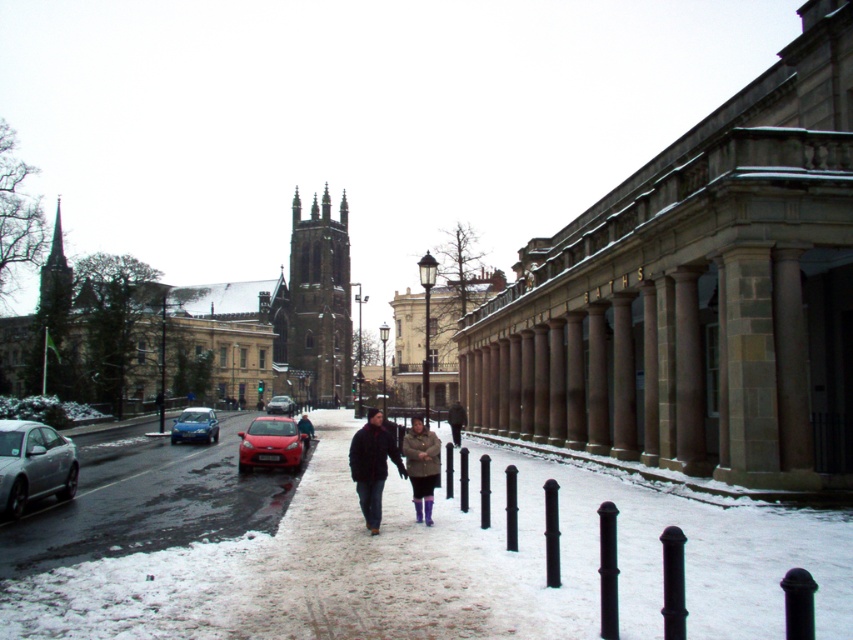
Which of these two, brown stone church at center or shiny red car at center, stands taller?

brown stone church at center is taller.

Which is in front, point (282, 275) or point (294, 460)?

Point (294, 460) is in front.

At what (x,y) coordinates should I click in order to perform the action: click on brown stone church at center. Please return your answer as a coordinate pair (x, y). The width and height of the screenshot is (853, 640). Looking at the image, I should click on (252, 326).

Does brown stone church at center appear under white stone church at center?

Actually, brown stone church at center is above white stone church at center.

Can you confirm if brown stone church at center is bigger than white stone church at center?

Yes.

Is point (346, 352) closer to viewer compared to point (505, 282)?

No, (346, 352) is further to viewer.

You are a GUI agent. You are given a task and a screenshot of the screen. Output one action in this format:
    pyautogui.click(x=<x>, y=<y>)
    Task: Click on the brown stone church at center
    The height and width of the screenshot is (640, 853).
    Given the screenshot: What is the action you would take?
    pyautogui.click(x=252, y=326)

Does matte black jacket at center have a larger size compared to matte red car at center?

Actually, matte black jacket at center might be smaller than matte red car at center.

Between matte black jacket at center and matte red car at center, which one has less height?

With less height is matte red car at center.

Is point (370, 508) more distant than point (282, 397)?

That is False.

Identify the location of matte black jacket at center. (372, 465).